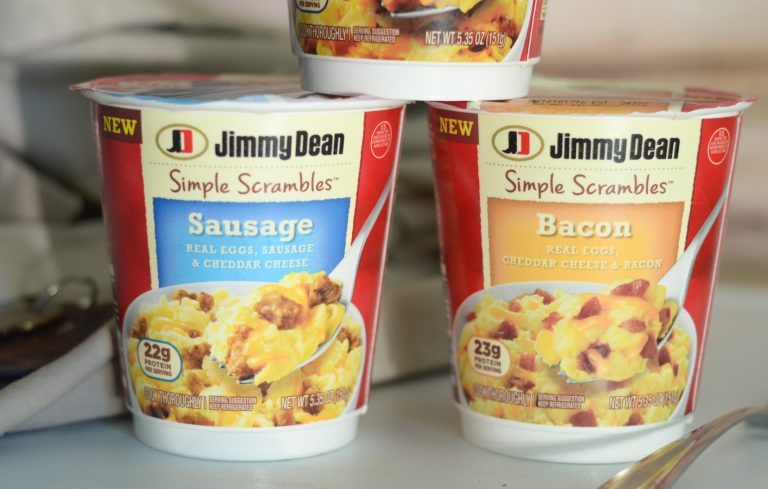
Identify the location of cup. (689, 226).